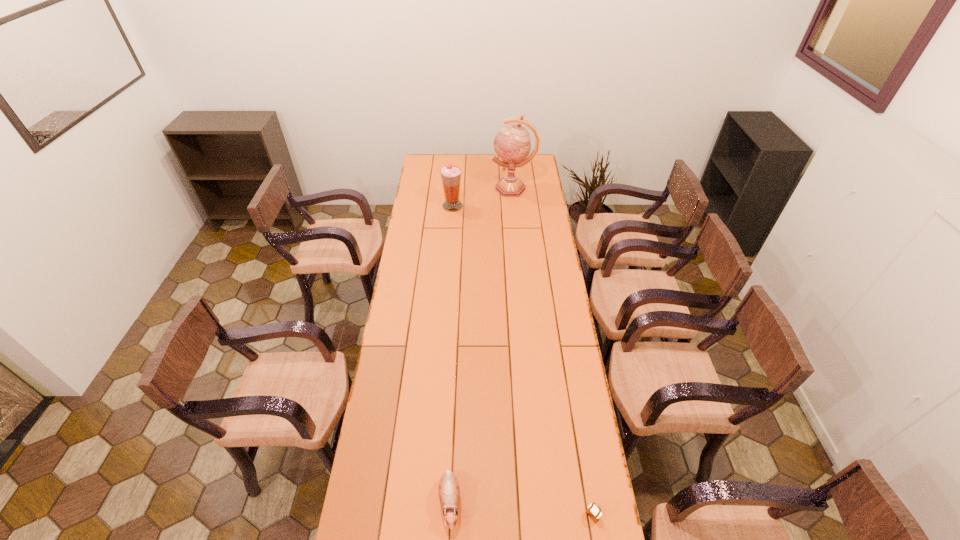
Where is `vacant area that lies between the padlock and the hamster`? This screenshot has height=540, width=960. vacant area that lies between the padlock and the hamster is located at coordinates (521, 509).

This screenshot has width=960, height=540. In order to click on empty space that is in between the padlock and the globe in this screenshot , I will do `click(553, 352)`.

This screenshot has height=540, width=960. Identify the location of free spot between the farthest object and the hamster. (481, 345).

At what (x,y) coordinates should I click in order to perform the action: click on vacant space that is in between the padlock and the smoothie. Please return your answer as a coordinate pair (x, y). This screenshot has width=960, height=540. Looking at the image, I should click on (522, 361).

Identify the location of unoccupied area between the hamster and the third shortest object. Image resolution: width=960 pixels, height=540 pixels. (451, 354).

Locate an element on the screen. The height and width of the screenshot is (540, 960). free space between the hamster and the padlock is located at coordinates (521, 509).

At what (x,y) coordinates should I click in order to perform the action: click on empty space between the hamster and the padlock. Please return your answer as a coordinate pair (x, y). This screenshot has width=960, height=540. Looking at the image, I should click on (521, 509).

At what (x,y) coordinates should I click in order to perform the action: click on blank region between the third shortest object and the hamster. Please return your answer as a coordinate pair (x, y). This screenshot has width=960, height=540. Looking at the image, I should click on (451, 354).

Image resolution: width=960 pixels, height=540 pixels. In order to click on object that is the closest to the third shortest object in this screenshot , I will do `click(512, 144)`.

This screenshot has height=540, width=960. In order to click on object that is the third closest to the padlock in this screenshot , I will do click(x=512, y=144).